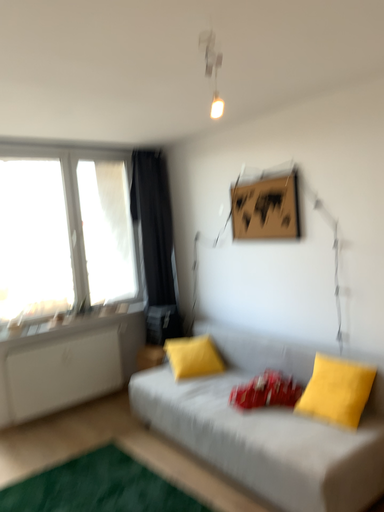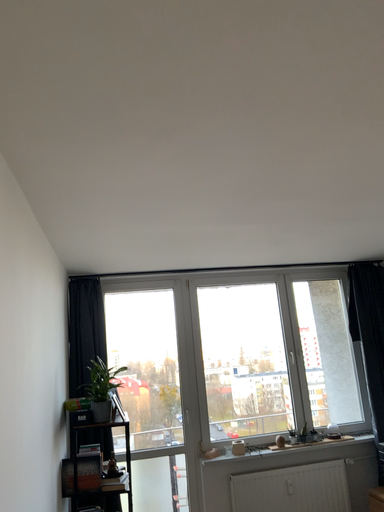
Question: How did the camera likely rotate when shooting the video?

Choices:
 (A) rotated left
 (B) rotated right

Answer: (A)